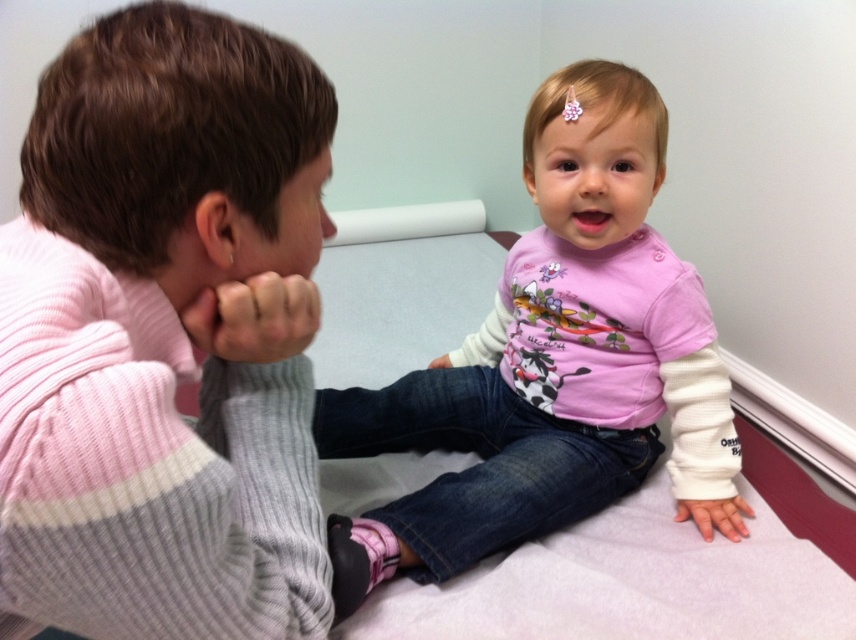
Question: Is pink matte hair clip at upper center positioned behind white matte hand at lower center?

Choices:
 (A) yes
 (B) no

Answer: (B)

Question: Which of these objects is positioned farthest from the matte gray sweater at left?

Choices:
 (A) pink matte hair clip at upper center
 (B) white matte hand at lower center
 (C) pink matte shirt at center

Answer: (B)

Question: Does pink ribbed sweater at left appear on the left side of matte gray sweater at left?

Choices:
 (A) no
 (B) yes

Answer: (B)

Question: Considering the real-world distances, which object is farthest from the matte gray sweater at left?

Choices:
 (A) pink matte shirt at center
 (B) white matte hand at lower center
 (C) pink ribbed sweater at left

Answer: (B)

Question: Considering the real-world distances, which object is farthest from the pink matte hair clip at upper center?

Choices:
 (A) pink matte shirt at center
 (B) pink ribbed sweater at left
 (C) matte gray sweater at left

Answer: (B)

Question: Can you confirm if pink matte shirt at center is bigger than pink matte hair clip at upper center?

Choices:
 (A) yes
 (B) no

Answer: (A)